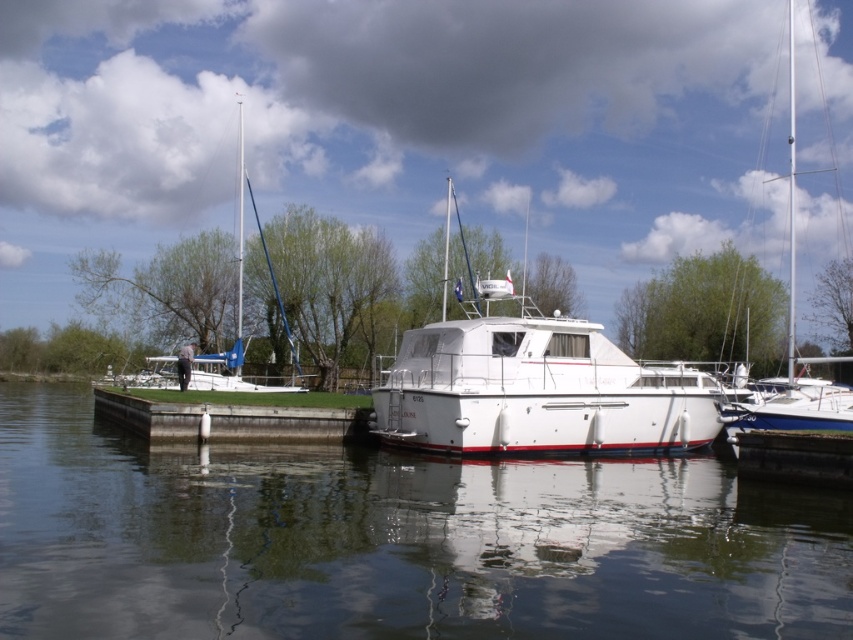
Question: Does transparent water at center come behind white glossy sailboat at right?

Choices:
 (A) no
 (B) yes

Answer: (A)

Question: Can you confirm if white glossy sailboat at right is wider than white glossy sailboat at left?

Choices:
 (A) yes
 (B) no

Answer: (A)

Question: Which point appears closest to the camera in this image?

Choices:
 (A) (752, 406)
 (B) (651, 419)

Answer: (A)

Question: Observing the image, what is the correct spatial positioning of white glossy boat at center in reference to white glossy sailboat at left?

Choices:
 (A) above
 (B) below

Answer: (B)

Question: Which object is positioned closest to the white glossy boat at center?

Choices:
 (A) white glossy sailboat at right
 (B) transparent water at center

Answer: (B)

Question: Which of the following is the farthest from the observer?

Choices:
 (A) (817, 586)
 (B) (817, 170)
 (C) (618, 410)
 (D) (238, 218)

Answer: (B)